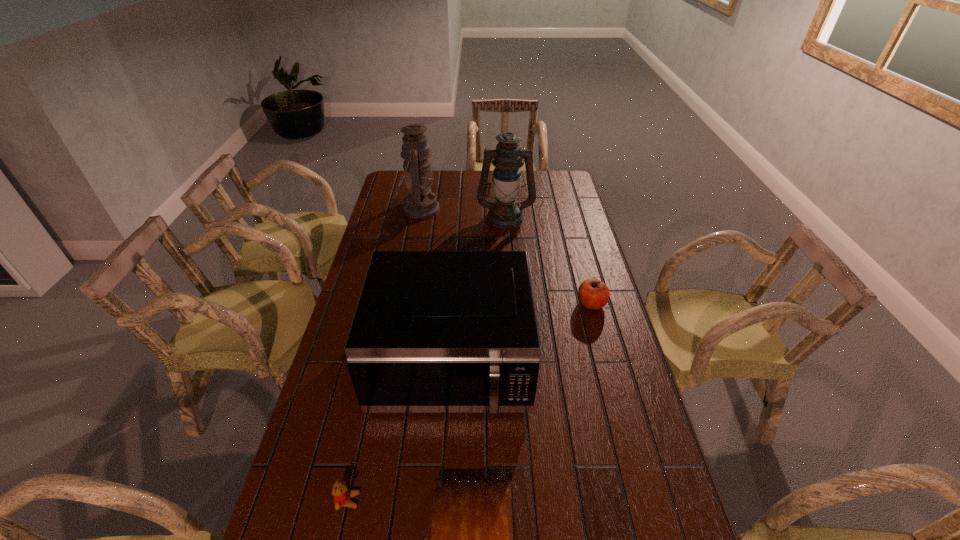
You are a GUI agent. You are given a task and a screenshot of the screen. Output one action in this format:
    pyautogui.click(x=<x>, y=<y>)
    Task: Click on the left oil lamp
    
    Given the screenshot: What is the action you would take?
    pyautogui.click(x=420, y=203)

Locate an element on the screen. The width and height of the screenshot is (960, 540). the right oil lamp is located at coordinates (506, 212).

This screenshot has width=960, height=540. Find the location of `the fourth farthest object`. the fourth farthest object is located at coordinates (434, 331).

This screenshot has height=540, width=960. In order to click on the third tallest object in this screenshot , I will do `click(434, 331)`.

Identify the location of apple. (593, 294).

Locate an element on the screen. The image size is (960, 540). the third farthest object is located at coordinates (593, 294).

You are a GUI agent. You are given a task and a screenshot of the screen. Output one action in this format:
    pyautogui.click(x=<x>, y=<y>)
    Task: Click on the teddy bear
    The height and width of the screenshot is (540, 960).
    Given the screenshot: What is the action you would take?
    pyautogui.click(x=342, y=495)

Locate an element on the screen. Image resolution: width=960 pixels, height=540 pixels. vacant area located 0.180m on the right of the left oil lamp is located at coordinates (479, 209).

Identify the location of vacant space located on the front of the right oil lamp. This screenshot has height=540, width=960. (511, 280).

Locate an element on the screen. This screenshot has height=540, width=960. vacant space situated 0.260m on the front-facing side of the microwave_oven is located at coordinates (441, 534).